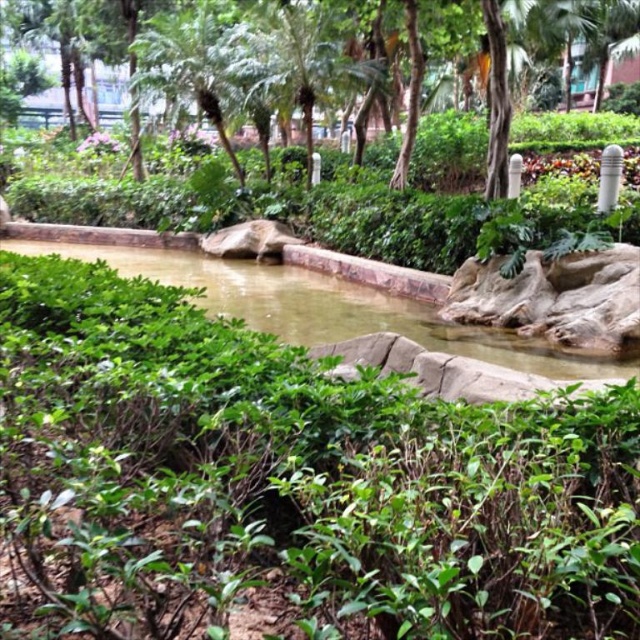
Does green leafy tree at upper center appear on the left side of greenish-brown water at center?

Indeed, green leafy tree at upper center is positioned on the left side of greenish-brown water at center.

Does green leafy tree at upper center appear on the right side of greenish-brown water at center?

No, green leafy tree at upper center is not to the right of greenish-brown water at center.

This screenshot has width=640, height=640. What are the coordinates of `green leafy tree at upper center` in the screenshot? It's located at (355, 64).